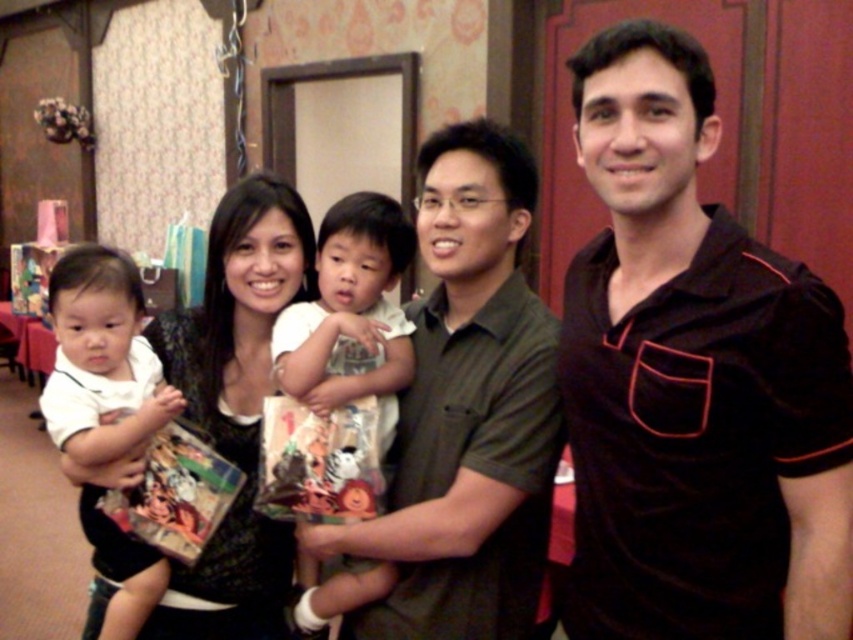
Does black velvety shirt at center appear on the right side of black textured dress at center?

Yes, black velvety shirt at center is to the right of black textured dress at center.

Does point (688, 273) come in front of point (183, 323)?

Yes.

At what (x,y) coordinates should I click in order to perform the action: click on black velvety shirt at center. Please return your answer as a coordinate pair (x, y). This screenshot has width=853, height=640. Looking at the image, I should click on (694, 380).

This screenshot has height=640, width=853. In order to click on dark green shirt at center in this screenshot , I will do `click(466, 412)`.

Is dark green shirt at center bigger than white matte shirt at center?

Correct, dark green shirt at center is larger in size than white matte shirt at center.

Is point (531, 468) more distant than point (70, 317)?

No, (531, 468) is in front of (70, 317).

The height and width of the screenshot is (640, 853). I want to click on dark green shirt at center, so click(466, 412).

Does white matte shirt at center have a greater height compared to white cotton shirt at center?

No, white matte shirt at center is not taller than white cotton shirt at center.

Is white matte shirt at center wider than white cotton shirt at center?

Yes, white matte shirt at center is wider than white cotton shirt at center.

Is point (62, 397) positioned before point (364, 588)?

No.

Find the location of `white matte shirt at center`. white matte shirt at center is located at coordinates (102, 358).